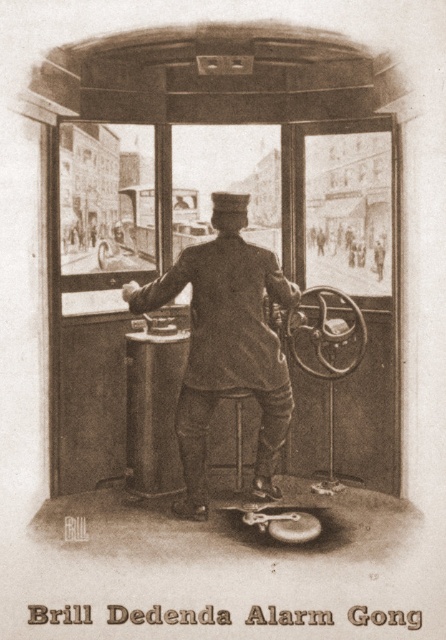
Question: Among these objects, which one is nearest to the camera?

Choices:
 (A) uniformed man at center
 (B) wooden stool at center

Answer: (A)

Question: Is uniformed man at center smaller than wooden stool at center?

Choices:
 (A) yes
 (B) no

Answer: (B)

Question: Is uniformed man at center to the left of wooden stool at center from the viewer's perspective?

Choices:
 (A) no
 (B) yes

Answer: (B)

Question: Can you confirm if uniformed man at center is bigger than wooden stool at center?

Choices:
 (A) no
 (B) yes

Answer: (B)